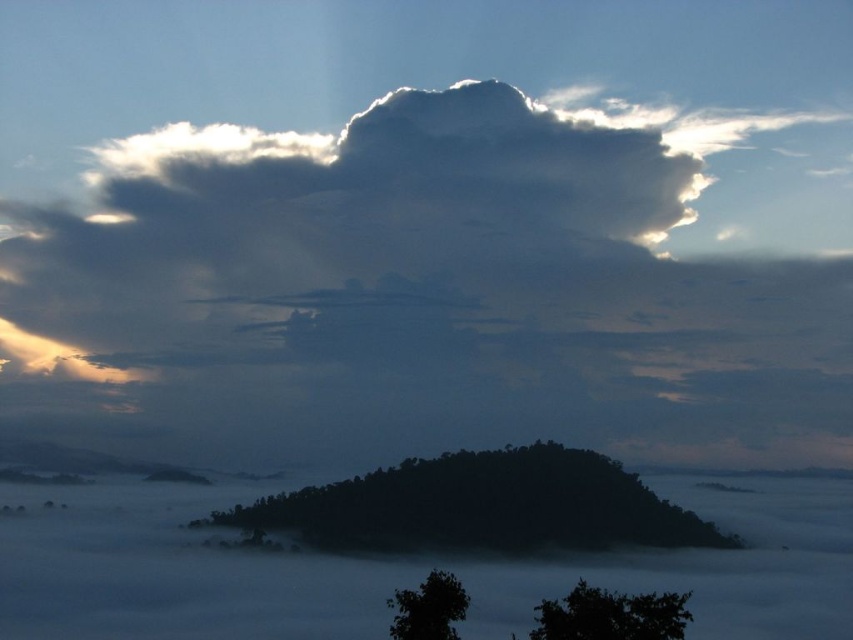
Question: Can you confirm if black matte tree at center is positioned above dark green leafy tree at lower right?

Choices:
 (A) no
 (B) yes

Answer: (B)

Question: Which point is closer to the camera?

Choices:
 (A) (599, 525)
 (B) (570, 637)

Answer: (B)

Question: Among these objects, which one is farthest from the camera?

Choices:
 (A) dark green leafy tree at lower center
 (B) dark green leafy tree at lower right

Answer: (A)

Question: Which is farther from the dark green leafy tree at lower center?

Choices:
 (A) black matte tree at center
 (B) dark green leafy tree at lower right

Answer: (A)

Question: Does black matte tree at center appear under dark green leafy tree at lower right?

Choices:
 (A) no
 (B) yes

Answer: (A)

Question: Does dark green leafy tree at lower right have a larger size compared to dark green leafy tree at lower center?

Choices:
 (A) yes
 (B) no

Answer: (A)